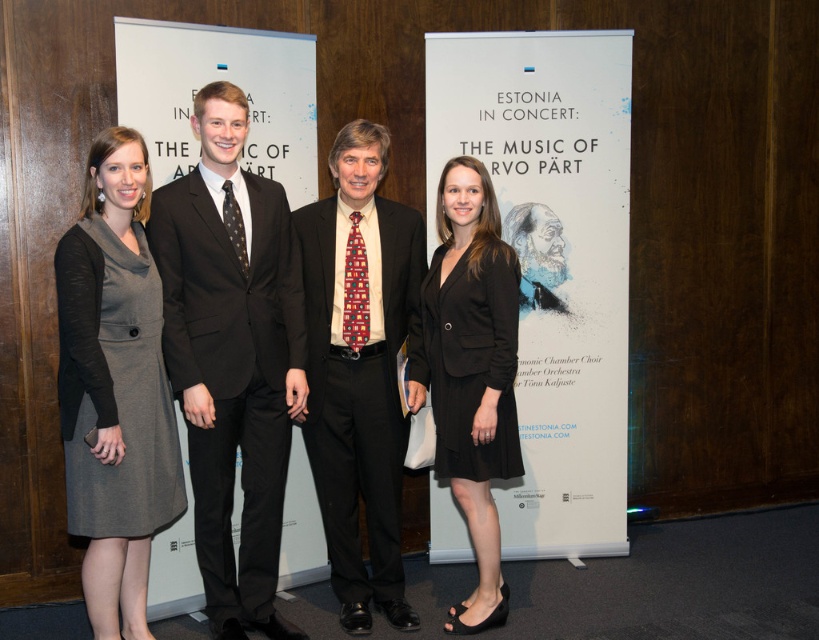
Question: Which point is farther from the camera taking this photo?

Choices:
 (A) (500, 308)
 (B) (580, 492)
 (C) (338, 541)

Answer: (B)

Question: Which point appears farthest from the camera in this image?

Choices:
 (A) (215, 218)
 (B) (236, 237)
 (C) (572, 61)
 (D) (356, 300)

Answer: (C)

Question: Can you confirm if white paper at center is bigger than black matte blazer at center?

Choices:
 (A) yes
 (B) no

Answer: (A)

Question: Does black satin suit at center appear on the right side of black matte blazer at center?

Choices:
 (A) yes
 (B) no

Answer: (B)

Question: Can you confirm if white paper at center is positioned above multicolored woven tie at center?

Choices:
 (A) no
 (B) yes

Answer: (A)

Question: Which of the following is the closest to the observer?

Choices:
 (A) (464, 321)
 (B) (233, 227)
 (C) (428, 182)

Answer: (B)